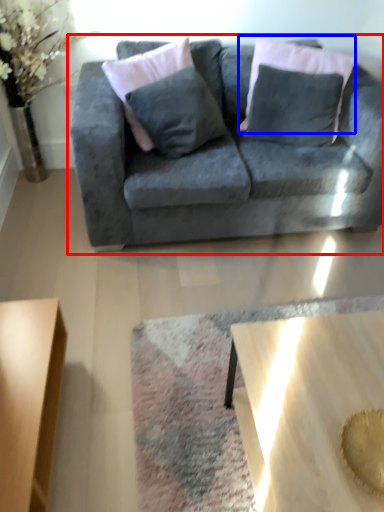
Question: Which object appears closest to the camera in this image, studio couch (highlighted by a red box) or pillow (highlighted by a blue box)?

Choices:
 (A) studio couch
 (B) pillow

Answer: (A)